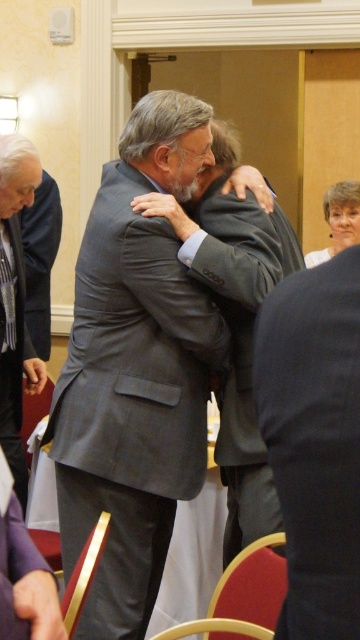
You are standing at the entrance of the room and want to greet the person closest to you. Which point should you walk towards, point (128, 264) or point (280, 520)?

Point (128, 264) is in front of point (280, 520), so you should walk towards point (128, 264) as it is closer to your current position at the entrance.